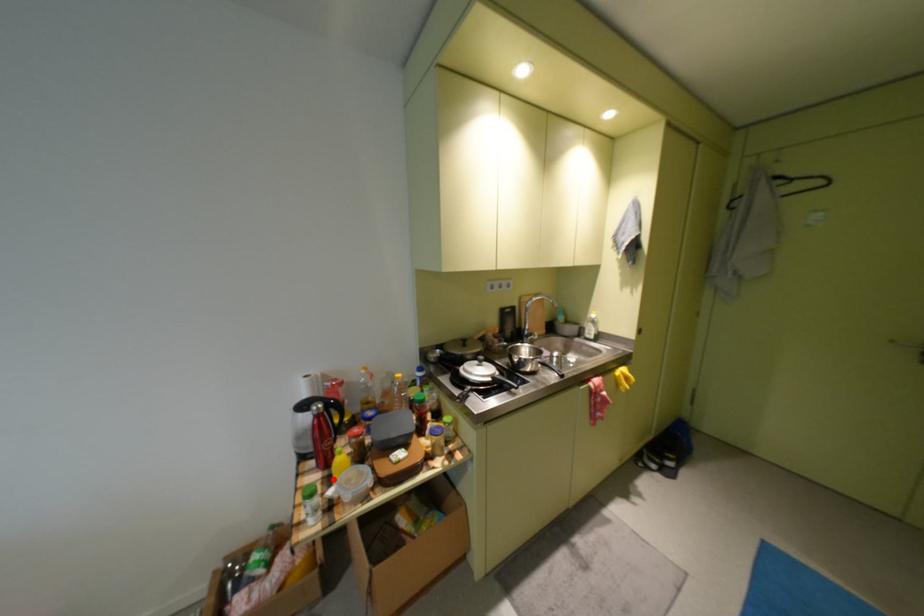
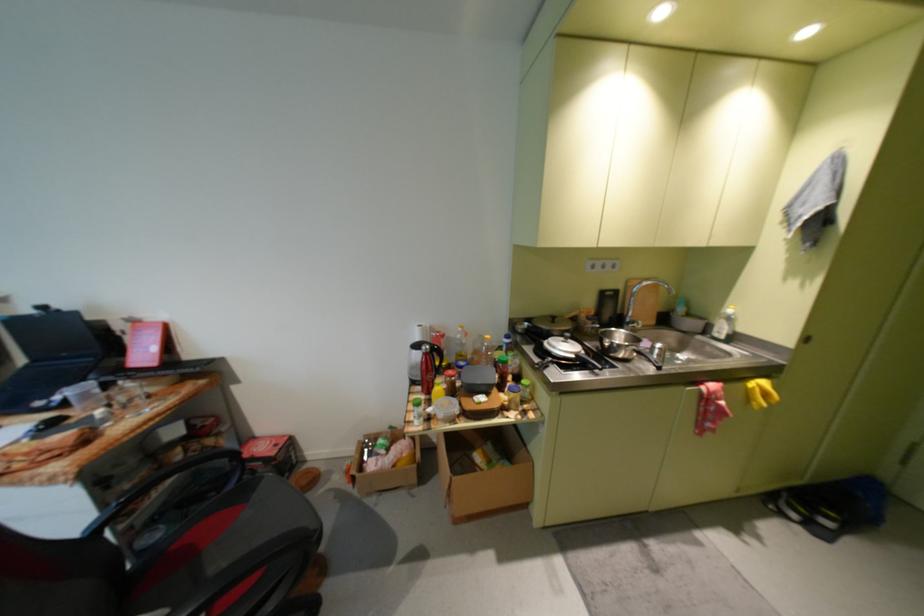
Where in the second image is the point corresponding to the highlighted location from the first image?

(435, 400)